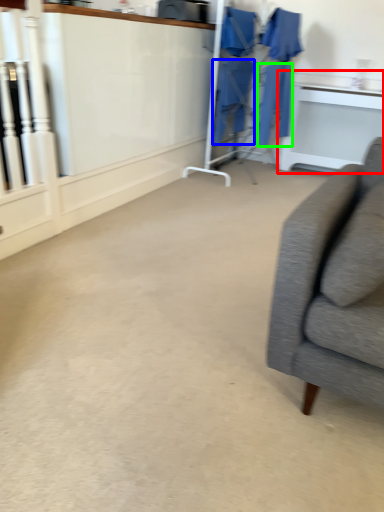
Question: Which object is positioned farthest from table (highlighted by a red box)? Select from robe (highlighted by a blue box) and robe (highlighted by a green box).

Choices:
 (A) robe
 (B) robe

Answer: (A)